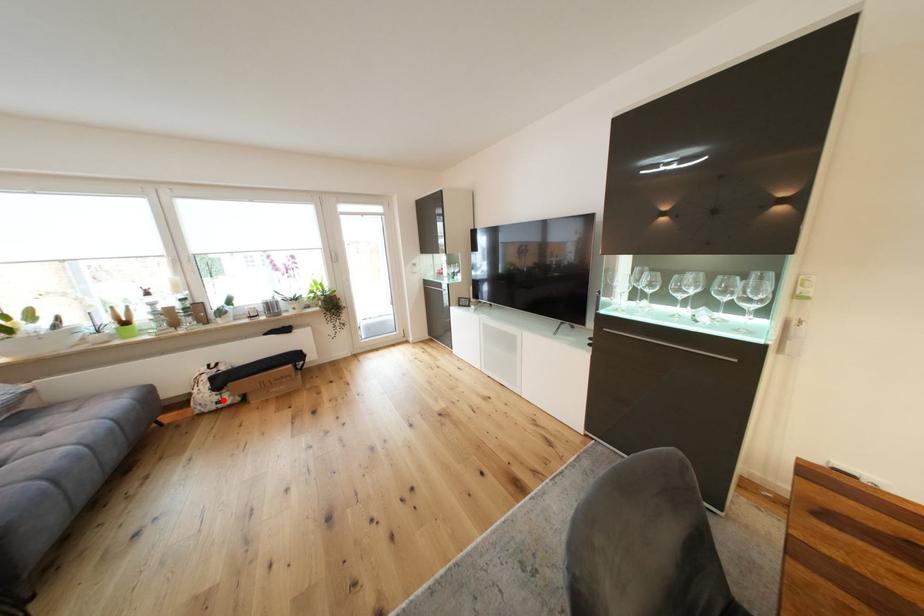
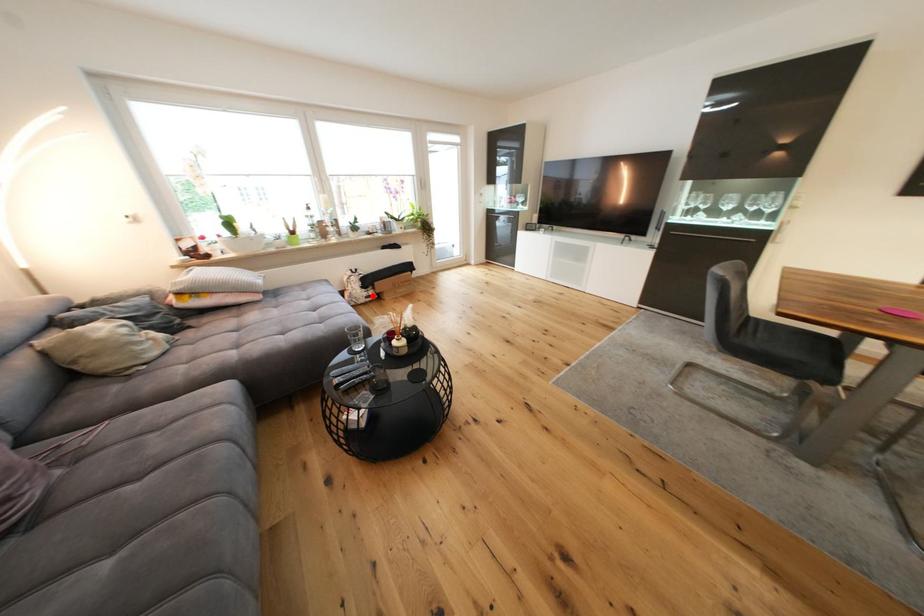
I am providing you with two images of the same scene from different viewpoints. A red point is marked on the first image and another point is marked on the second image. Is the marked point in image1 the same physical position as the marked point in image2?

Yes